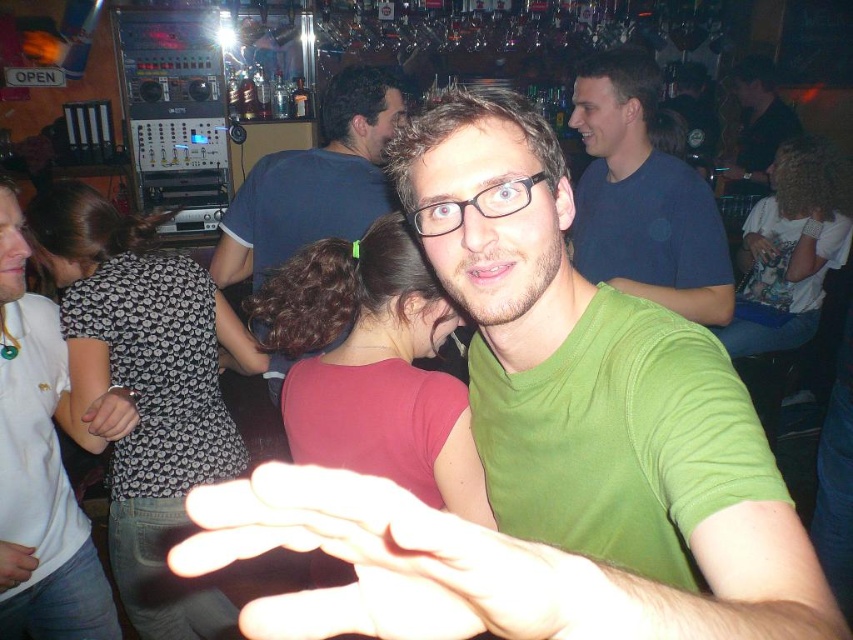
Question: Which of the following is the closest to the observer?

Choices:
 (A) (77, 392)
 (B) (276, 198)
 (C) (111, 598)
 (D) (590, 253)

Answer: (A)

Question: Observing the image, what is the correct spatial positioning of green matte shirt at upper right in reference to blue cotton shirt at center?

Choices:
 (A) right
 (B) left

Answer: (A)

Question: Does bright white flesh at center appear over green matte shirt at upper right?

Choices:
 (A) yes
 (B) no

Answer: (B)

Question: Which point is closer to the camera?

Choices:
 (A) (10, 541)
 (B) (625, 282)

Answer: (A)

Question: Is green matte shirt at upper right above light skin hand at center?

Choices:
 (A) no
 (B) yes

Answer: (B)

Question: Which point is closer to the camera?

Choices:
 (A) (636, 268)
 (B) (12, 540)
 (C) (267, 598)

Answer: (C)